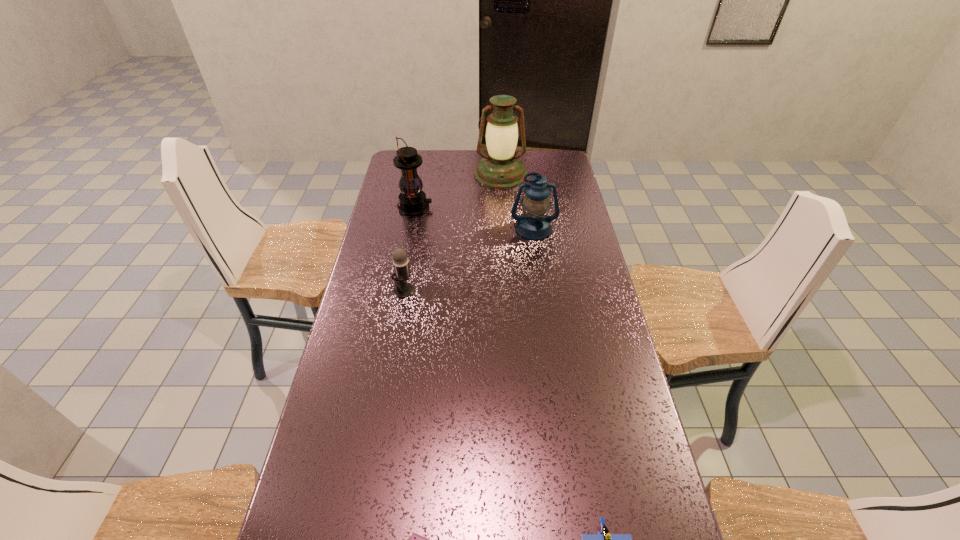
Locate an element on the screen. free point between the nearest lantern and the fourth farthest object is located at coordinates (468, 259).

Locate an element on the screen. This screenshot has width=960, height=540. empty space between the third shortest object and the farthest lantern is located at coordinates (452, 232).

This screenshot has height=540, width=960. What are the coordinates of `object that stands as the third closest to the farthest lantern` in the screenshot? It's located at (400, 260).

This screenshot has width=960, height=540. Identify the location of object that can be found as the second closest to the third object from left to right. (400, 260).

Select which lantern is the closest to the second nearest lantern. Please provide its 2D coordinates. Your answer should be formatted as a tuple, i.e. [(x, y)], where the tuple contains the x and y coordinates of a point satisfying the conditions above.

[(501, 168)]

Identify which lantern is the second nearest to the third shortest object. Please provide its 2D coordinates. Your answer should be formatted as a tuple, i.e. [(x, y)], where the tuple contains the x and y coordinates of a point satisfying the conditions above.

[(534, 224)]

Locate an element on the screen. This screenshot has height=540, width=960. free spot that satisfies the following two spatial constraints: 1. above the second nearest lantern, indicating its light source; 2. on the back side of the third shortest object is located at coordinates (399, 290).

This screenshot has height=540, width=960. What are the coordinates of `vacant position in the image that satisfies the following two spatial constraints: 1. above the leftmost lantern, indicating its light source; 2. on the right side of the third nearest object` in the screenshot? It's located at (399, 290).

Identify the location of vacant position in the image that satisfies the following two spatial constraints: 1. with the light compartment facing forward on the farthest lantern; 2. above the second nearest lantern, indicating its light source. The height and width of the screenshot is (540, 960). (503, 207).